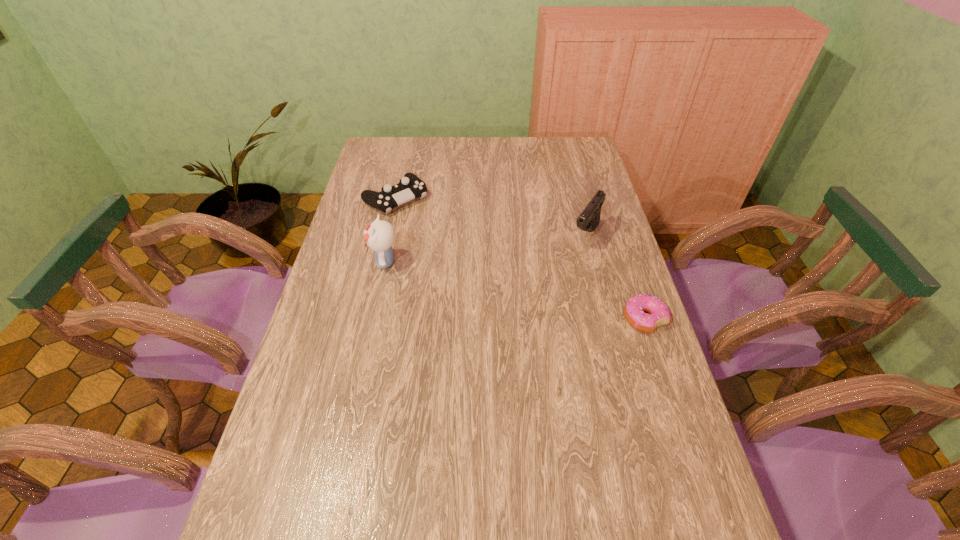
Locate an element on the screen. This screenshot has width=960, height=540. vacant space located 0.350m at the barrel of the third shortest object is located at coordinates (531, 322).

At what (x,y) coordinates should I click in order to perform the action: click on vacant area situated 0.120m at the barrel of the third shortest object. Please return your answer as a coordinate pair (x, y). The image size is (960, 540). Looking at the image, I should click on (564, 272).

Identify the location of vacant space situated on the surface of the control. This screenshot has height=540, width=960. (444, 241).

I want to click on vacant space located on the surface of the control, so click(x=441, y=238).

The width and height of the screenshot is (960, 540). In order to click on vacant space located on the surface of the control in this screenshot , I will do `click(461, 255)`.

Find the location of a particular element. This screenshot has height=540, width=960. kitten at the left edge is located at coordinates (379, 236).

Identify the location of control at the left edge. The height and width of the screenshot is (540, 960). (410, 187).

Where is `doughnut at the right edge`? doughnut at the right edge is located at coordinates 659,314.

Image resolution: width=960 pixels, height=540 pixels. Identify the location of pistol that is at the right edge. (588, 220).

Where is `vacant space at the far edge of the desktop`? This screenshot has height=540, width=960. vacant space at the far edge of the desktop is located at coordinates (491, 158).